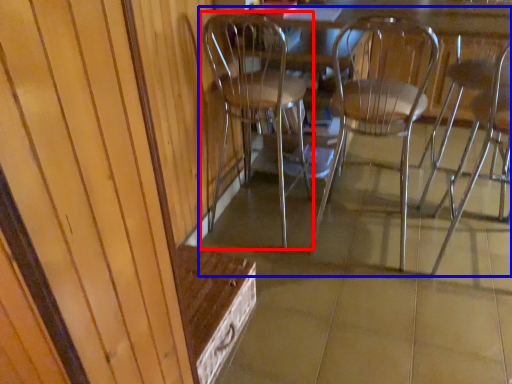
Question: Which object is further to the camera taking this photo, chair (highlighted by a red box) or chair (highlighted by a blue box)?

Choices:
 (A) chair
 (B) chair

Answer: (A)